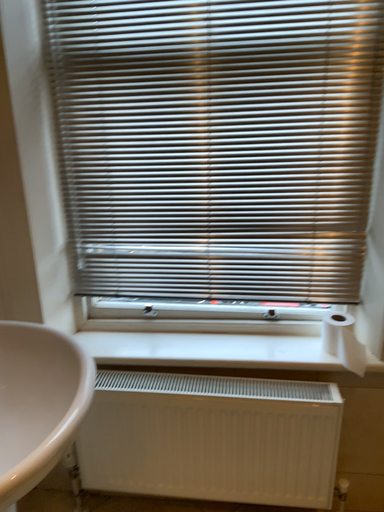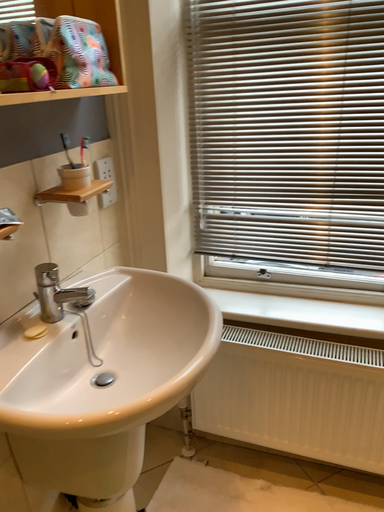
Question: How did the camera likely rotate when shooting the video?

Choices:
 (A) rotated right
 (B) rotated left

Answer: (B)